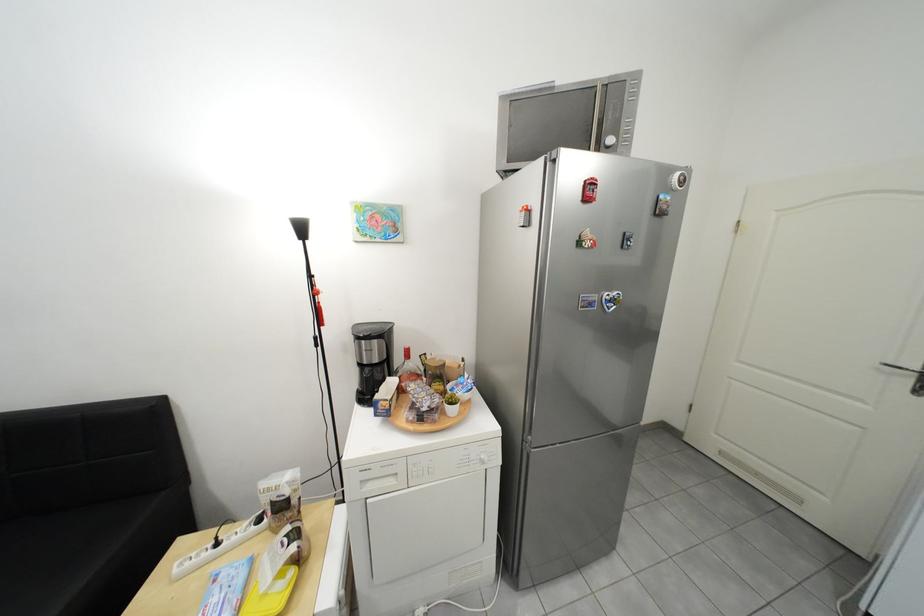
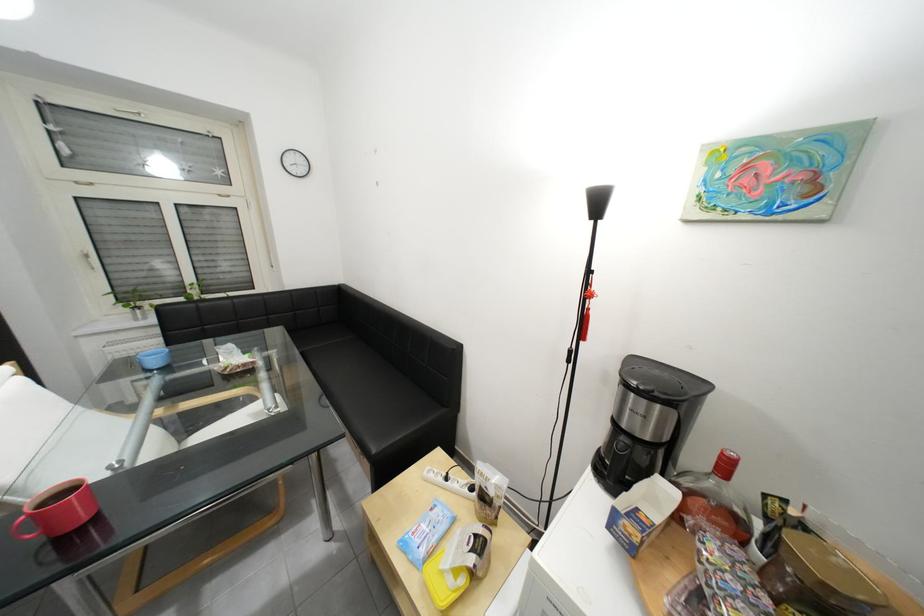
Where in the second image is the point corresponding to point (379, 371) from the first image?

(636, 440)